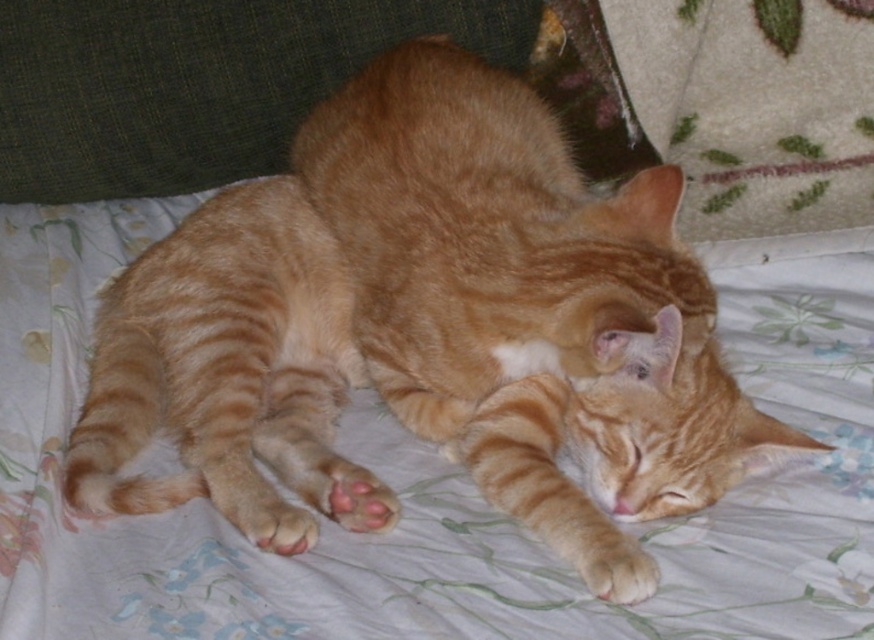
Does green fabric pillow at upper left have a smaller size compared to orange fur paw at lower center?

Incorrect, green fabric pillow at upper left is not smaller in size than orange fur paw at lower center.

Which is below, green fabric pillow at upper left or orange fur paw at lower center?

orange fur paw at lower center is lower down.

What are the coordinates of `green fabric pillow at upper left` in the screenshot? It's located at [x=195, y=83].

Locate an element on the screen. This screenshot has width=874, height=640. green fabric pillow at upper left is located at coordinates (195, 83).